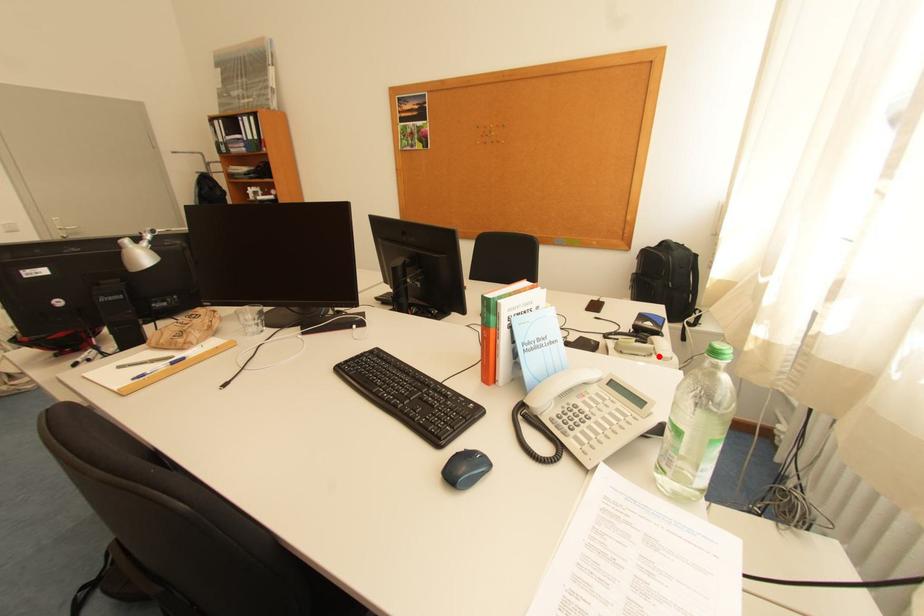
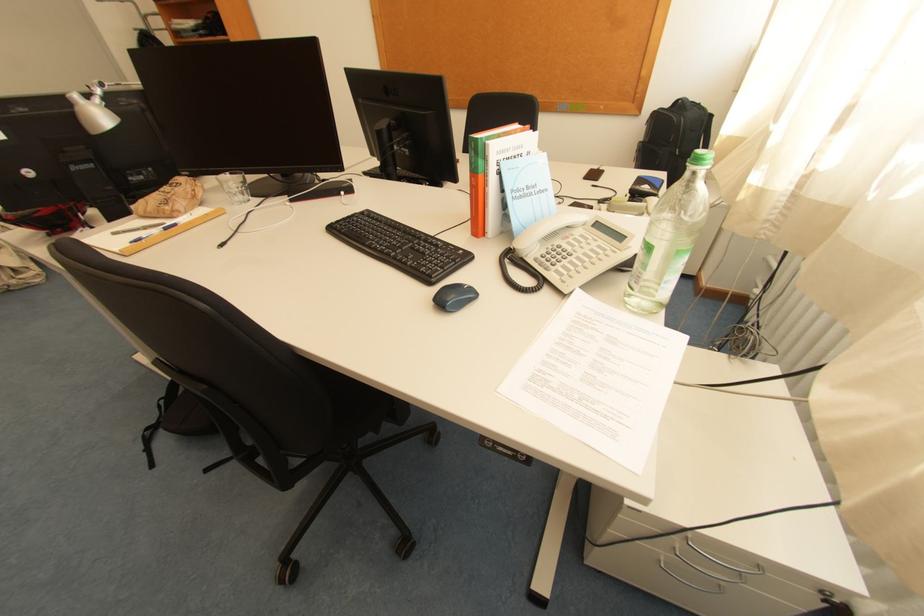
Question: I am providing you with two images of the same scene from different viewpoints. Image1 has a red point marked. In image2, the corresponding 3D location appears at what relative position? Reply with the corresponding letter.

Choices:
 (A) Closer
 (B) Farther

Answer: (B)